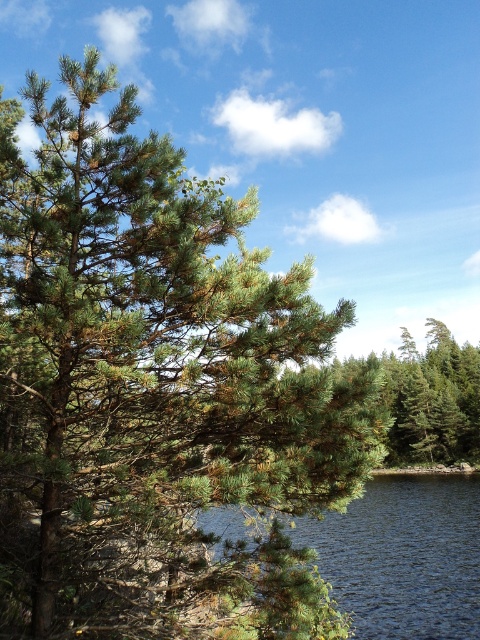
You are standing in the natural landscape scene. You see the transparent blue water at lower center and the green matte tree at center. Which object is positioned to the left of the other?

The transparent blue water at lower center is to the left of the green matte tree at center.

You are standing at the point marked by coordinates point (x=404, y=556) in the image. What object is directly beneath your feet?

The transparent blue water at lower center is located at point (x=404, y=556), so the object directly beneath your feet is the transparent blue water at lower center.